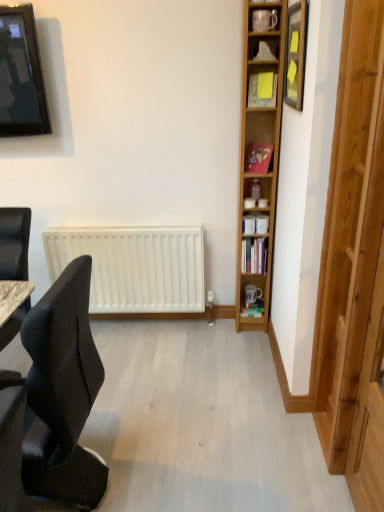
Question: Is point (266, 263) positioned closer to the camera than point (31, 6)?

Choices:
 (A) farther
 (B) closer

Answer: (A)

Question: Considering their positions, is hardcover book at center located in front of or behind matte black television at upper left?

Choices:
 (A) behind
 (B) front

Answer: (A)

Question: Which object is the farthest from the black fabric chair at left?

Choices:
 (A) hardcover book at center
 (B) yellow paper at upper center
 (C) transparent wooden door at right
 (D) matte black television at upper left
 (E) wooden picture frame at upper right

Answer: (B)

Question: Considering the real-world distances, which object is farthest from the transparent wooden door at right?

Choices:
 (A) black fabric chair at left
 (B) wooden bookcase at right
 (C) wooden picture frame at upper right
 (D) matte black television at upper left
 (E) hardcover book at center

Answer: (D)